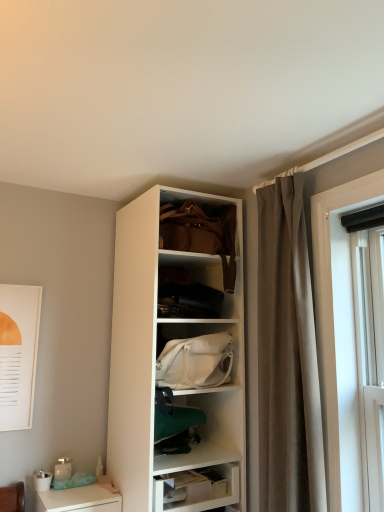
Question: Is white glossy desk at lower left wider or thinner than leather handbag at upper center, arranged as the first handbag when viewed from the top?

Choices:
 (A) thin
 (B) wide

Answer: (B)

Question: From a real-world perspective, is white glossy desk at lower left positioned above or below leather handbag at upper center, marked as the 2th handbag in a bottom-to-top arrangement?

Choices:
 (A) below
 (B) above

Answer: (A)

Question: Which object is positioned farthest from the leather handbag at upper center, arranged as the first handbag when viewed from the top?

Choices:
 (A) white glossy desk at lower left
 (B) brown fabric curtain at right
 (C) white fabric handbag at center, the first handbag from the bottom

Answer: (A)

Question: Which object is the closest to the white fabric handbag at center, arranged as the 2th handbag when viewed from the top?

Choices:
 (A) brown fabric curtain at right
 (B) white glossy desk at lower left
 (C) leather handbag at upper center, arranged as the first handbag when viewed from the top

Answer: (A)